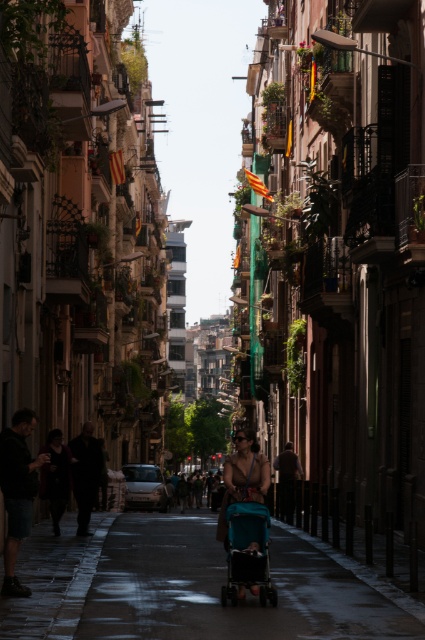
Can you confirm if teal plastic stroller at center is shorter than teal fabric stroller at center?

In fact, teal plastic stroller at center may be taller than teal fabric stroller at center.

Is teal plastic stroller at center above teal fabric stroller at center?

No, teal plastic stroller at center is not above teal fabric stroller at center.

Where is `teal plastic stroller at center`? teal plastic stroller at center is located at coordinates (184, 588).